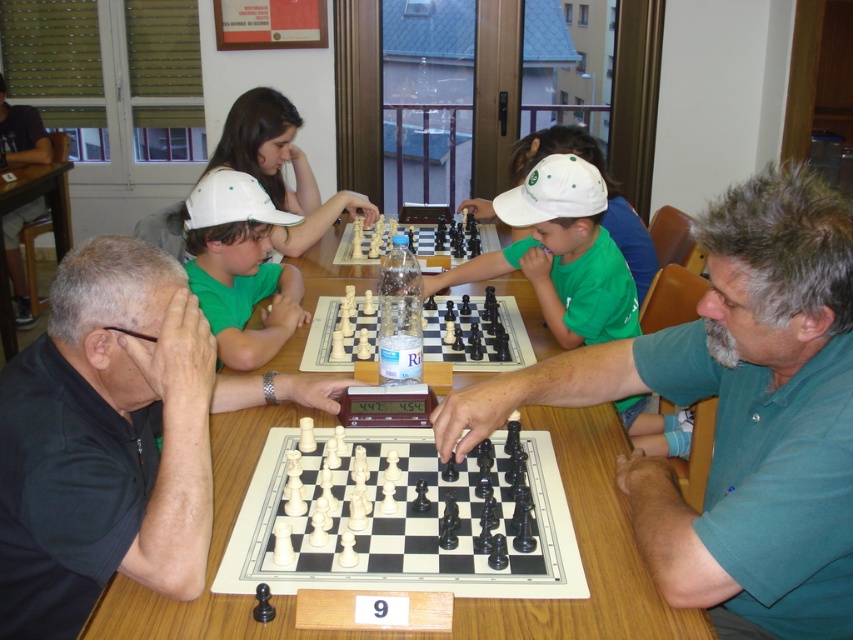
Does matte black chess set at center have a larger size compared to matte green cap at center?

Correct, matte black chess set at center is larger in size than matte green cap at center.

How much distance is there between matte black chess set at center and matte green cap at center?

They are 36.54 inches apart.

Which is in front, point (715, 449) or point (279, 333)?

Positioned in front is point (715, 449).

Identify the location of matte black chess set at center. This screenshot has width=853, height=640. pos(734,413).

Can you confirm if matte green cap at center is shorter than white matte cap at center?

Yes.

Who is higher up, matte green cap at center or white matte cap at center?

white matte cap at center is above.

This screenshot has width=853, height=640. What are the coordinates of `matte green cap at center` in the screenshot? It's located at (241, 266).

This screenshot has height=640, width=853. I want to click on matte green cap at center, so click(241, 266).

Can you confirm if matte black chess piece at center is positioned to the right of wooden chessboard at center?

In fact, matte black chess piece at center is to the left of wooden chessboard at center.

Does matte black chess piece at center have a greater height compared to wooden chessboard at center?

Yes.

At what (x,y) coordinates should I click in order to perform the action: click on matte black chess piece at center. Please return your answer as a coordinate pair (x, y). This screenshot has height=640, width=853. Looking at the image, I should click on (21, 132).

Identify the location of matte black chess piece at center. (21, 132).